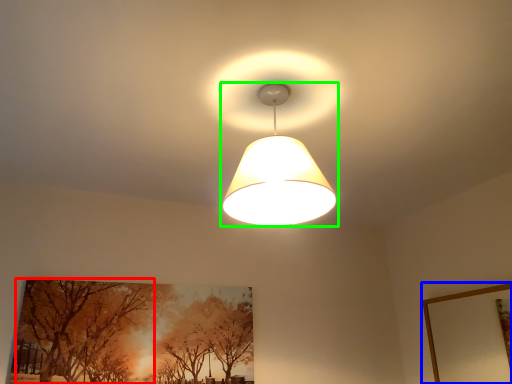
Question: Which object is positioned closest to tree (highlighted by a red box)? Select from picture frame (highlighted by a blue box) and lamp (highlighted by a green box).

Choices:
 (A) picture frame
 (B) lamp

Answer: (B)